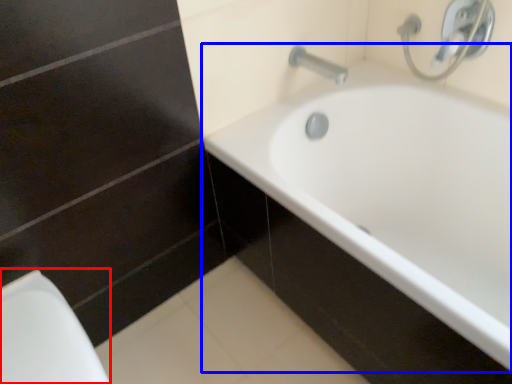
Question: Which object appears farthest to the camera in this image, porcelain (highlighted by a red box) or bathtub (highlighted by a blue box)?

Choices:
 (A) porcelain
 (B) bathtub

Answer: (A)